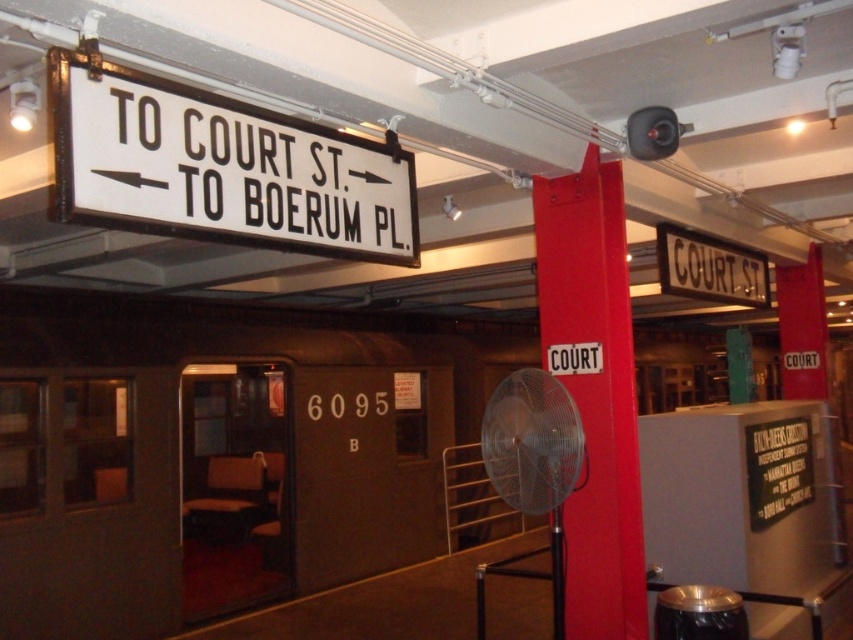
How far apart are white plastic sign at upper center and red matte signpost at center?

The distance of white plastic sign at upper center from red matte signpost at center is 5.27 feet.

How far apart are white plastic sign at upper center and red matte signpost at center?

A distance of 5.27 feet exists between white plastic sign at upper center and red matte signpost at center.

Describe the element at coordinates (221, 168) in the screenshot. I see `white plastic sign at upper center` at that location.

Find the location of a particular element. This screenshot has height=640, width=853. white plastic sign at upper center is located at coordinates (221, 168).